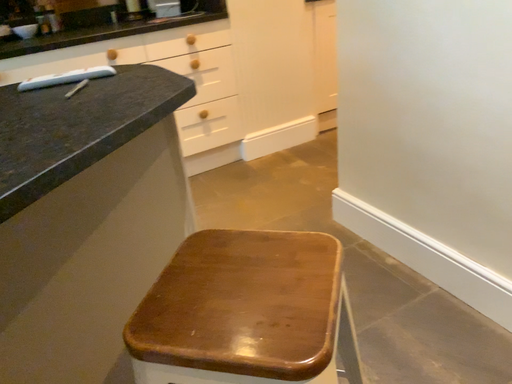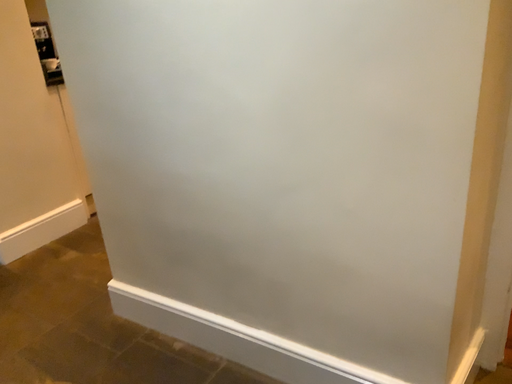
Question: How did the camera likely rotate when shooting the video?

Choices:
 (A) rotated left
 (B) rotated right

Answer: (B)